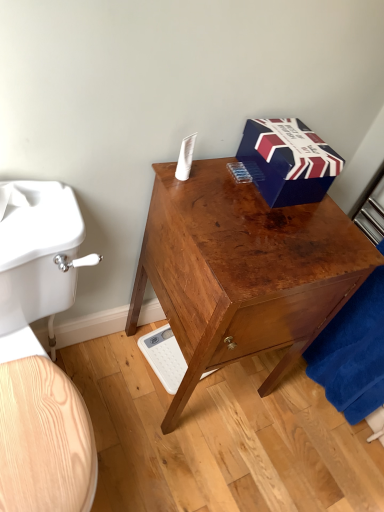
Image resolution: width=384 pixels, height=512 pixels. Identify the location of vacant region to the left of blue cardboard box at upper right. (219, 176).